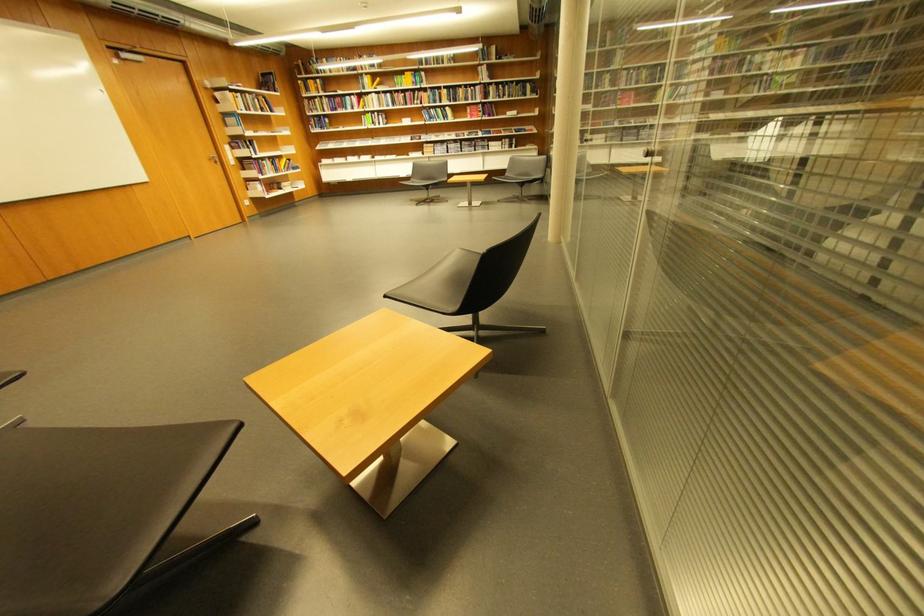
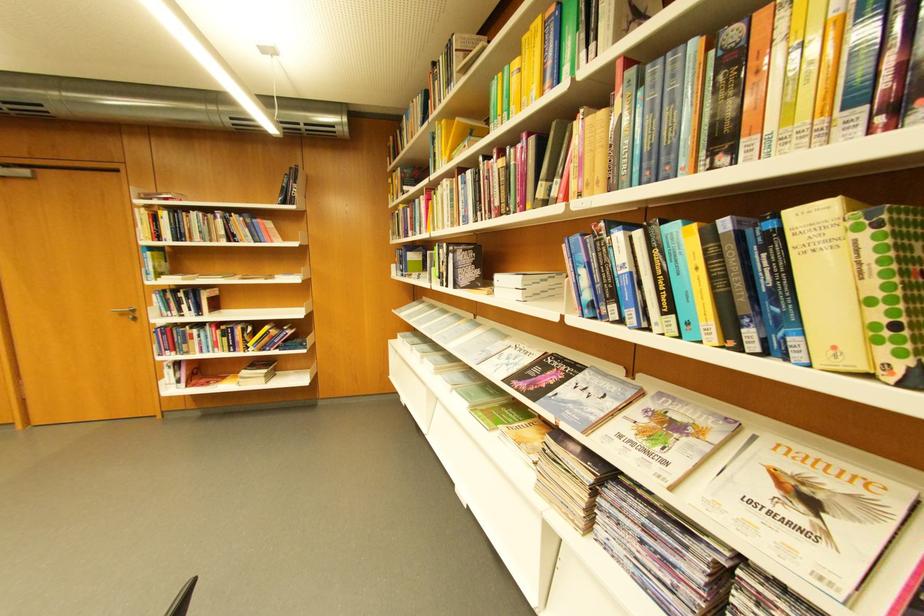
Locate, in the second image, the point that corresponds to point (383, 124) in the first image.

(451, 278)